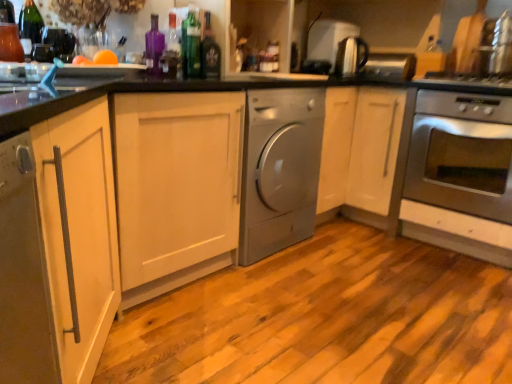
Question: Which direction should I rotate to look at shiny dark glass bottle at center, marked as the 1th bottle in a right-to-left arrangement?

Choices:
 (A) left
 (B) right

Answer: (A)

Question: Considering the relative sizes of shiny dark glass bottle at center, marked as the 1th bottle in a right-to-left arrangement, and purple glass bottle at upper center, the second bottle positioned from the left, in the image provided, is shiny dark glass bottle at center, marked as the 1th bottle in a right-to-left arrangement, wider than purple glass bottle at upper center, the second bottle positioned from the left,?

Choices:
 (A) no
 (B) yes

Answer: (B)

Question: From the image's perspective, is shiny dark glass bottle at center, marked as the 1th bottle in a right-to-left arrangement, over purple glass bottle at upper center, the second bottle positioned from the left?

Choices:
 (A) no
 (B) yes

Answer: (B)

Question: Is shiny dark glass bottle at center, marked as the 1th bottle in a right-to-left arrangement, positioned with its back to purple glass bottle at upper center, the 3th bottle when ordered from right to left?

Choices:
 (A) no
 (B) yes

Answer: (A)

Question: Is the position of shiny dark glass bottle at center, which is counted as the 4th bottle, starting from the left, less distant than that of purple glass bottle at upper center, the 3th bottle when ordered from right to left?

Choices:
 (A) yes
 (B) no

Answer: (B)

Question: Would you consider shiny dark glass bottle at center, marked as the 1th bottle in a right-to-left arrangement, to be distant from purple glass bottle at upper center, the second bottle positioned from the left?

Choices:
 (A) yes
 (B) no

Answer: (B)

Question: Would you say purple glass bottle at upper center, the 3th bottle when ordered from right to left, is part of shiny dark glass bottle at center, which is counted as the 4th bottle, starting from the left,'s contents?

Choices:
 (A) no
 (B) yes

Answer: (A)

Question: From a real-world perspective, is purple glass bottle at upper center, the 3th bottle when ordered from right to left, below satin silver toaster at upper center, the second appliance viewed from the front?

Choices:
 (A) no
 (B) yes

Answer: (B)

Question: Considering the relative positions of purple glass bottle at upper center, the 3th bottle when ordered from right to left, and satin silver toaster at upper center, the second appliance viewed from the front, in the image provided, is purple glass bottle at upper center, the 3th bottle when ordered from right to left, behind satin silver toaster at upper center, the second appliance viewed from the front,?

Choices:
 (A) no
 (B) yes

Answer: (A)

Question: Is purple glass bottle at upper center, the 3th bottle when ordered from right to left, oriented away from satin silver toaster at upper center, the second appliance viewed from the front?

Choices:
 (A) no
 (B) yes

Answer: (A)

Question: From the image's perspective, does purple glass bottle at upper center, the 3th bottle when ordered from right to left, appear lower than satin silver toaster at upper center, the second appliance viewed from the front?

Choices:
 (A) yes
 (B) no

Answer: (A)

Question: Considering the relative positions of purple glass bottle at upper center, the 3th bottle when ordered from right to left, and satin silver toaster at upper center, the second appliance viewed from the front, in the image provided, is purple glass bottle at upper center, the 3th bottle when ordered from right to left, to the left of satin silver toaster at upper center, the second appliance viewed from the front, from the viewer's perspective?

Choices:
 (A) no
 (B) yes

Answer: (B)

Question: Is purple glass bottle at upper center, the second bottle positioned from the left, outside satin silver toaster at upper center, the second appliance viewed from the front?

Choices:
 (A) yes
 (B) no

Answer: (A)

Question: Considering the relative positions of satin silver toaster at upper center, which is counted as the 1th appliance, starting from the back, and purple glass bottle at upper center, the second bottle positioned from the left, in the image provided, is satin silver toaster at upper center, which is counted as the 1th appliance, starting from the back, in front of purple glass bottle at upper center, the second bottle positioned from the left,?

Choices:
 (A) no
 (B) yes

Answer: (A)